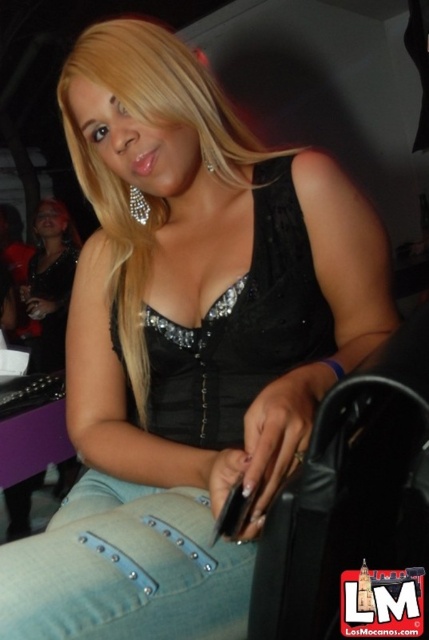
You are taking a photo of the woman in the image. You want to focus on the point closer to the camera. Which point should you choose between point (160,579) and point (75,259)?

Point (160,579) is closer to the camera than point (75,259), so you should choose point (160,579) to focus on.

You are a photographer trying to capture a closeup of the jeans at lower left without the matte black dress at center blocking the view. Is this possible given their positions?

The jeans at lower left is in front of the matte black dress at center, so the dress will block the view of the jeans. Adjust your angle to avoid the dress.

You are a fashion designer who wants to create a new outfit using the jeans at lower left and the matte black dress at center. Which item should you choose if you want to use the larger piece of clothing?

The matte black dress at center is larger than the jeans at lower left, so you should choose the matte black dress at center for the larger piece of clothing.